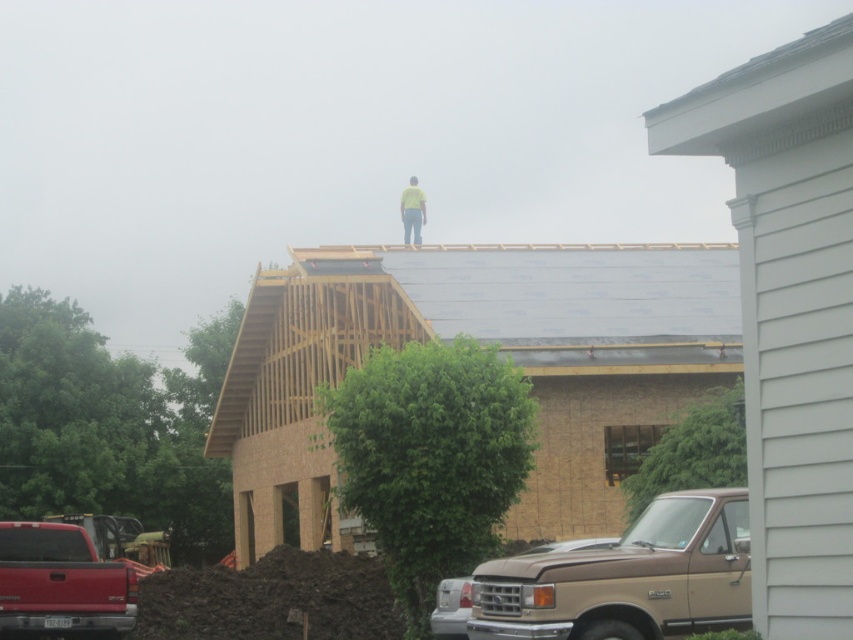
You are a contractor planning to install the gray asphalt shingles at center on the roof. The yellow fabric construction worker at upper center is currently standing on the roof. Based on their sizes, can the worker safely handle the installation without the shingles being too large to manage?

The gray asphalt shingles at center are smaller in size compared to the yellow fabric construction worker at upper center, so the worker can safely handle the installation as the shingles are manageable in size.

You are a construction worker standing at the base of the house. You need to place gray asphalt shingles at center. Where should you place them?

You should place the gray asphalt shingles at center at the coordinates point (476, 316).

You are a construction worker standing at point (421, 198) and need to reach point (627, 566). Based on the scene description, which direction should you move to get there?

You should move forward because point (627, 566) is in front of point (421, 198).